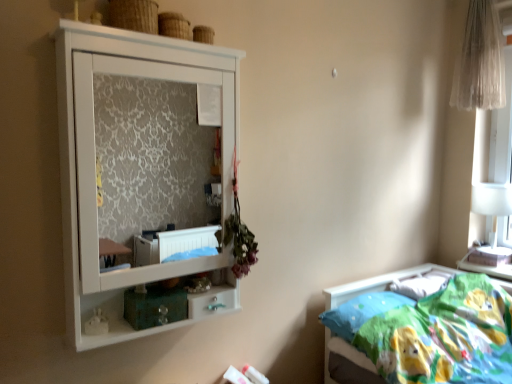
Question: From a real-world perspective, is white glossy drawer at lower center positioned over white glossy table lamp at right based on gravity?

Choices:
 (A) no
 (B) yes

Answer: (A)

Question: From the image's perspective, is white glossy drawer at lower center under white glossy table lamp at right?

Choices:
 (A) yes
 (B) no

Answer: (A)

Question: Is white glossy drawer at lower center positioned beyond the bounds of white glossy table lamp at right?

Choices:
 (A) yes
 (B) no

Answer: (A)

Question: From a real-world perspective, is white glossy drawer at lower center physically below white glossy table lamp at right?

Choices:
 (A) no
 (B) yes

Answer: (B)

Question: Is white glossy table lamp at right surrounded by white glossy drawer at lower center?

Choices:
 (A) no
 (B) yes

Answer: (A)

Question: Is the position of white glossy drawer at lower center less distant than that of white glossy table lamp at right?

Choices:
 (A) no
 (B) yes

Answer: (B)

Question: Does soft cotton bed at lower right have a greater width compared to white glossy drawer at lower center?

Choices:
 (A) yes
 (B) no

Answer: (A)

Question: Does soft cotton bed at lower right turn towards white glossy drawer at lower center?

Choices:
 (A) no
 (B) yes

Answer: (B)

Question: Is soft cotton bed at lower right far away from white glossy drawer at lower center?

Choices:
 (A) yes
 (B) no

Answer: (B)

Question: Does soft cotton bed at lower right have a lesser width compared to white glossy drawer at lower center?

Choices:
 (A) yes
 (B) no

Answer: (B)

Question: Is soft cotton bed at lower right beside white glossy drawer at lower center?

Choices:
 (A) no
 (B) yes

Answer: (A)

Question: Does soft cotton bed at lower right contain white glossy drawer at lower center?

Choices:
 (A) no
 (B) yes

Answer: (A)

Question: Is white matte cupboard at upper left not near blue fabric pillow at lower right?

Choices:
 (A) no
 (B) yes

Answer: (B)